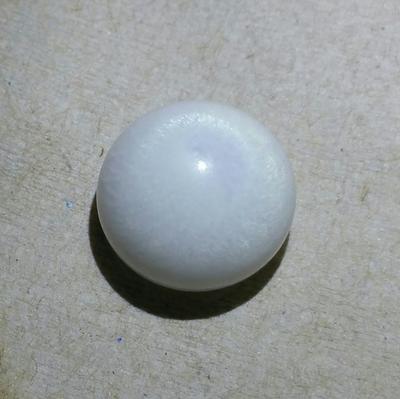
Where is `canvas`? This screenshot has height=399, width=400. canvas is located at coordinates (327, 117).